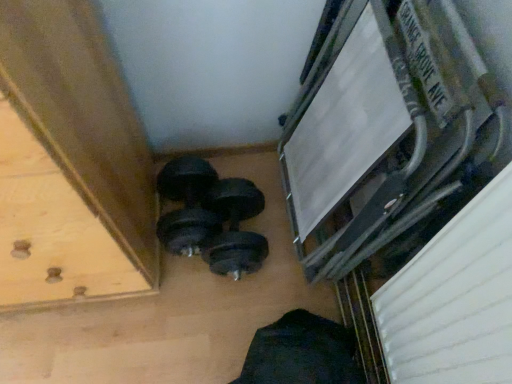
Question: From the image's perspective, does black rubber dumbbell at center, which is the 2th dumbbell in left-to-right order, appear higher than wooden drawer at lower left?

Choices:
 (A) no
 (B) yes

Answer: (A)

Question: Is black rubber dumbbell at center, the 1th dumbbell viewed from the right, positioned before wooden drawer at lower left?

Choices:
 (A) no
 (B) yes

Answer: (A)

Question: Are black rubber dumbbell at center, the 1th dumbbell viewed from the right, and wooden drawer at lower left far apart?

Choices:
 (A) yes
 (B) no

Answer: (B)

Question: Is black rubber dumbbell at center, the 1th dumbbell viewed from the right, directly adjacent to wooden drawer at lower left?

Choices:
 (A) yes
 (B) no

Answer: (B)

Question: Considering the relative positions of black rubber dumbbell at center, which is the 2th dumbbell in left-to-right order, and wooden drawer at lower left in the image provided, is black rubber dumbbell at center, which is the 2th dumbbell in left-to-right order, behind wooden drawer at lower left?

Choices:
 (A) no
 (B) yes

Answer: (B)

Question: Considering the positions of black rubber dumbbell at lower center, the 2th dumbbell from the right, and metallic silver frame at upper right in the image, is black rubber dumbbell at lower center, the 2th dumbbell from the right, bigger or smaller than metallic silver frame at upper right?

Choices:
 (A) small
 (B) big

Answer: (A)

Question: Is point (168, 175) positioned closer to the camera than point (367, 110)?

Choices:
 (A) farther
 (B) closer

Answer: (A)

Question: Is black rubber dumbbell at lower center, which is counted as the first dumbbell, starting from the left, in front of or behind metallic silver frame at upper right in the image?

Choices:
 (A) behind
 (B) front

Answer: (A)

Question: From the image's perspective, is black rubber dumbbell at lower center, which is counted as the first dumbbell, starting from the left, above or below metallic silver frame at upper right?

Choices:
 (A) above
 (B) below

Answer: (B)

Question: Which is correct: metallic silver frame at upper right is inside wooden drawer at lower left, or outside of it?

Choices:
 (A) outside
 (B) inside

Answer: (A)

Question: From the image's perspective, is metallic silver frame at upper right positioned above or below wooden drawer at lower left?

Choices:
 (A) above
 (B) below

Answer: (A)

Question: Looking at their shapes, would you say metallic silver frame at upper right is wider or thinner than wooden drawer at lower left?

Choices:
 (A) wide
 (B) thin

Answer: (B)

Question: From their relative heights in the image, would you say metallic silver frame at upper right is taller or shorter than wooden drawer at lower left?

Choices:
 (A) short
 (B) tall

Answer: (A)

Question: Based on their sizes in the image, would you say black rubber dumbbell at center, the 1th dumbbell viewed from the right, is bigger or smaller than wooden drawer at lower left?

Choices:
 (A) small
 (B) big

Answer: (A)

Question: Looking at their shapes, would you say black rubber dumbbell at center, which is the 2th dumbbell in left-to-right order, is wider or thinner than wooden drawer at lower left?

Choices:
 (A) wide
 (B) thin

Answer: (B)